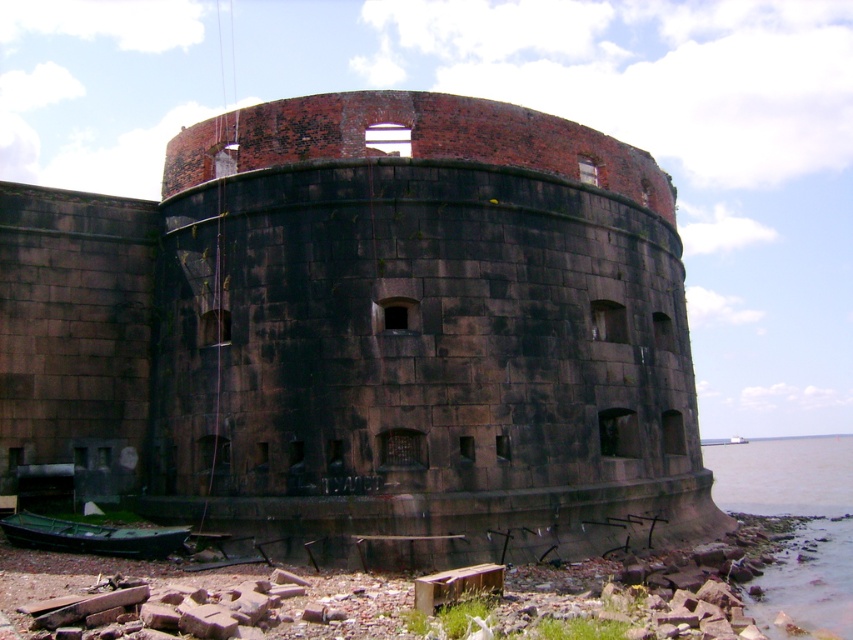
Question: Does dark brick castle at center appear under green matte boat at lower left?

Choices:
 (A) no
 (B) yes

Answer: (A)

Question: Which object appears farthest from the camera in this image?

Choices:
 (A) dark brick castle at center
 (B) brown water at lower right

Answer: (A)

Question: Does dark brick castle at center have a larger size compared to green matte boat at lower left?

Choices:
 (A) yes
 (B) no

Answer: (A)

Question: In this image, where is dark brick castle at center located relative to green matte boat at lower left?

Choices:
 (A) left
 (B) right

Answer: (B)

Question: Which point is closer to the camera taking this photo?

Choices:
 (A) (619, 321)
 (B) (763, 582)
 (C) (134, 538)

Answer: (C)

Question: Estimate the real-world distances between objects in this image. Which object is closer to the dark brick castle at center?

Choices:
 (A) green matte boat at lower left
 (B) brown water at lower right

Answer: (A)